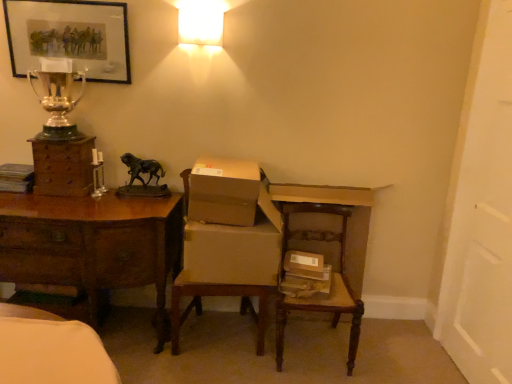
At what (x,y) coordinates should I click in order to perform the action: click on free space above matte black picture frame at upper left (from a real-world perspective). Please return your answer as a coordinate pair (x, y). Looking at the image, I should click on (64, 3).